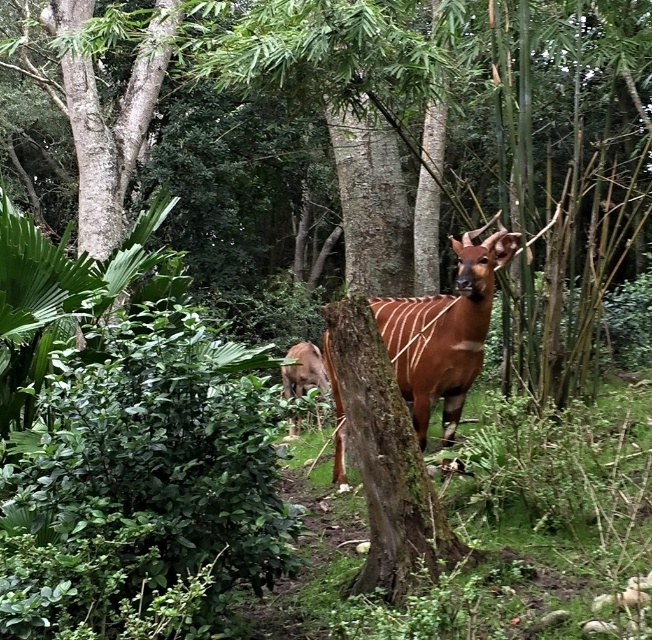
Question: Is green mossy bark tree trunk at center below brown velvet antelope at center?

Choices:
 (A) yes
 (B) no

Answer: (B)

Question: Which point appears closest to the camera in this image?

Choices:
 (A) (374, 349)
 (B) (471, 310)
 (C) (321, 365)

Answer: (A)

Question: Which point is closer to the camera?

Choices:
 (A) (299, 394)
 (B) (374, 580)

Answer: (B)

Question: Is green mossy bark tree trunk at center in front of brown velvet antelope at center?

Choices:
 (A) no
 (B) yes

Answer: (B)

Question: Among these objects, which one is nearest to the camera?

Choices:
 (A) green mossy bark tree trunk at center
 (B) brown velvet antelope at center

Answer: (A)

Question: Is green mossy bark tree trunk at center smaller than brown velvet antelope at center?

Choices:
 (A) yes
 (B) no

Answer: (A)